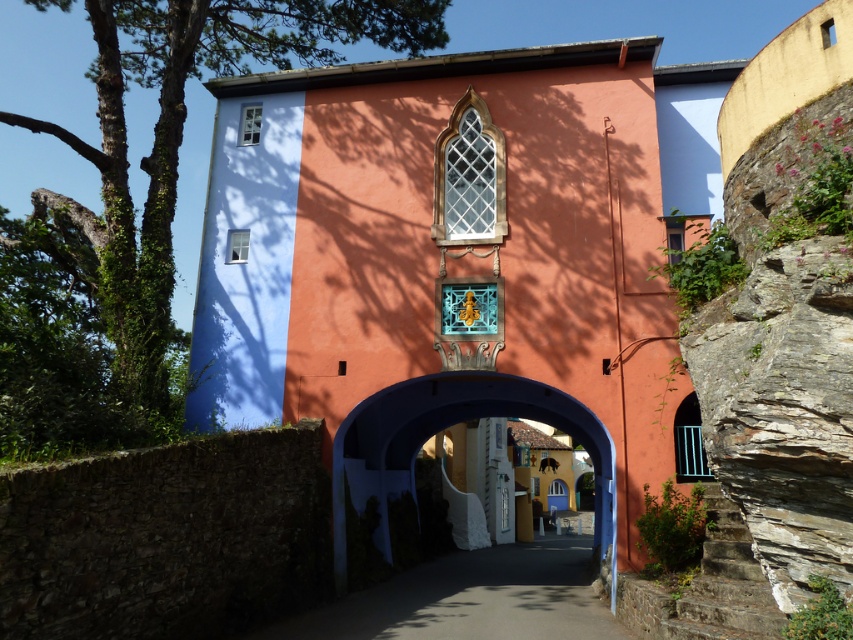
Question: Which of the following is the closest to the observer?

Choices:
 (A) paved concrete alley at center
 (B) green leafy tree at upper left

Answer: (A)

Question: Is paved concrete alley at center positioned before blue matte archway at center?

Choices:
 (A) no
 (B) yes

Answer: (B)

Question: Which of the following is the farthest from the observer?

Choices:
 (A) paved concrete alley at center
 (B) green leafy tree at upper left
 (C) brown stone wall at lower left
 (D) blue matte archway at center

Answer: (D)

Question: Is brown stone wall at lower left to the right of blue matte archway at center from the viewer's perspective?

Choices:
 (A) no
 (B) yes

Answer: (A)

Question: Which object is closer to the camera taking this photo?

Choices:
 (A) paved concrete alley at center
 (B) green leafy tree at upper left
 (C) brown stone wall at lower left

Answer: (C)

Question: Can you confirm if green leafy tree at upper left is positioned to the right of blue matte archway at center?

Choices:
 (A) no
 (B) yes

Answer: (A)